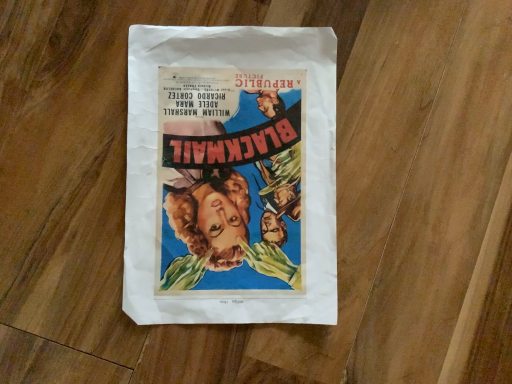
Locate an element on the screen. vacant region above vintage paper poster at center (from a real-world perspective) is located at coordinates (226, 163).